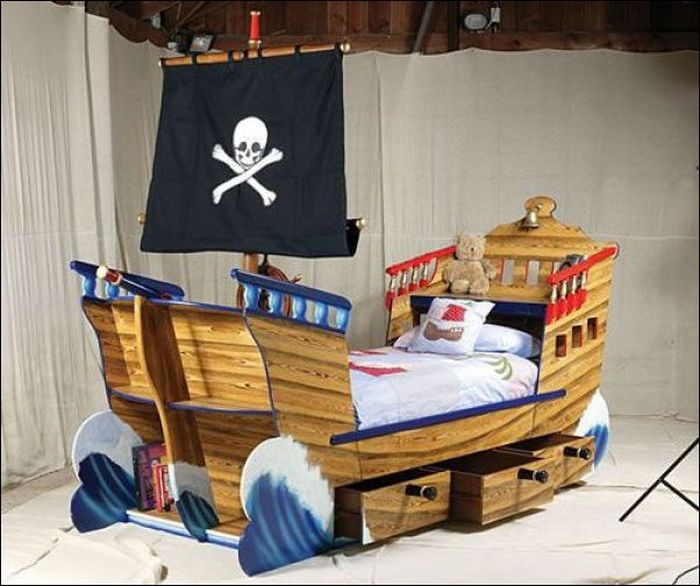
Identify the location of child's bed. Image resolution: width=700 pixels, height=586 pixels. (409, 374).